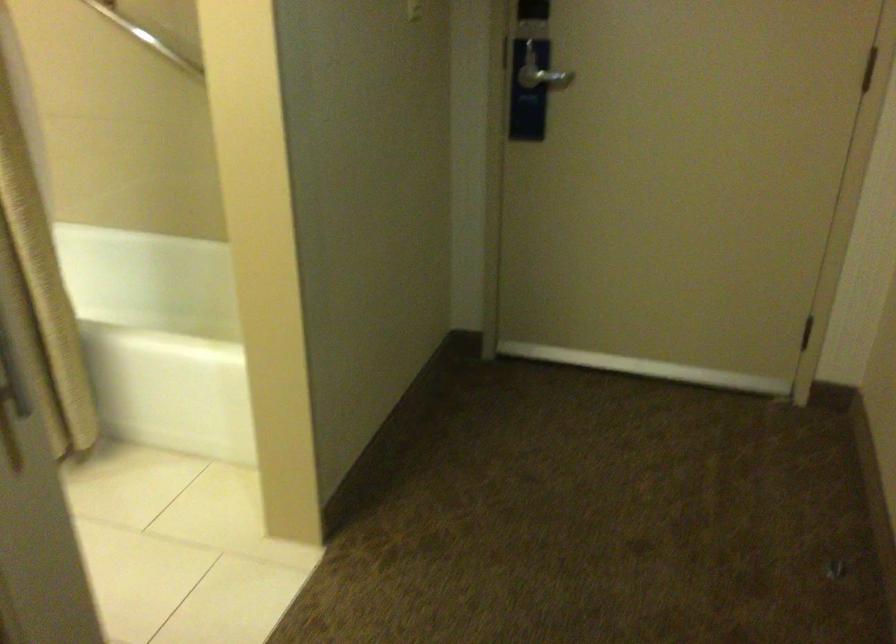
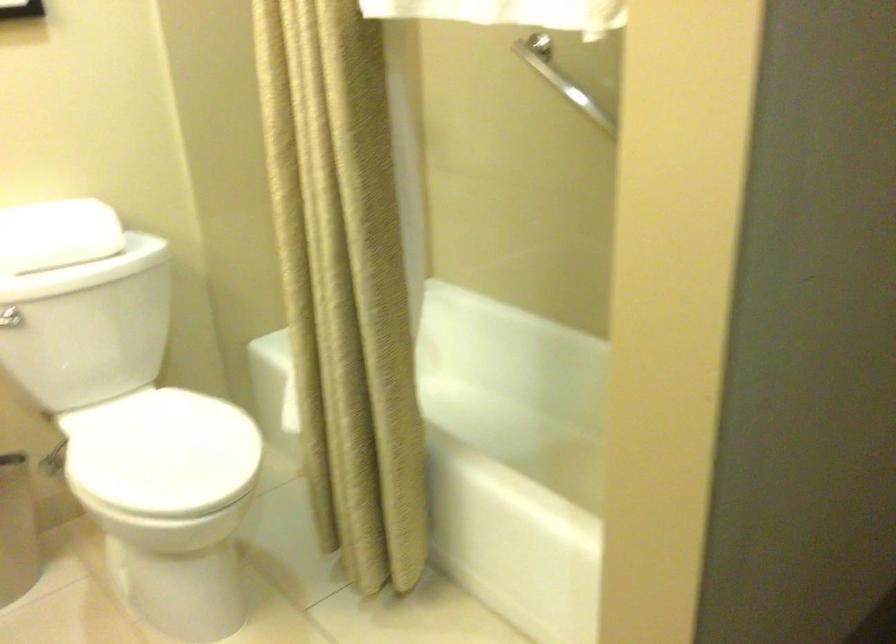
Question: The camera is either moving clockwise (left) or counter-clockwise (right) around the object. The first image is from the beginning of the video and the second image is from the end. Is the camera moving left or right when shooting the video?

Choices:
 (A) Left
 (B) Right

Answer: (B)